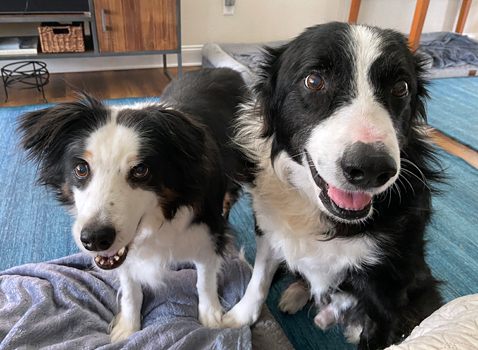
Identify the location of wooden floor. The height and width of the screenshot is (350, 478). (119, 88).